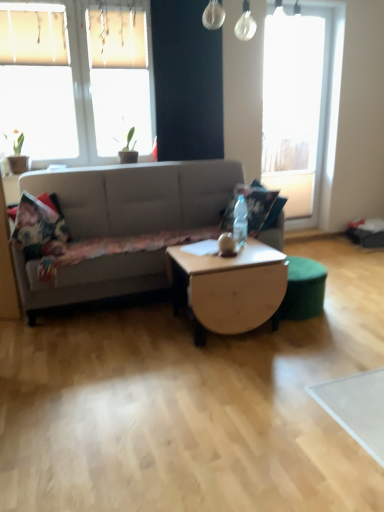
You are a GUI agent. You are given a task and a screenshot of the screen. Output one action in this format:
    pyautogui.click(x=<x>, y=<y>)
    Task: Click on the vacant space positioned to the left of wooden coffee table at center
    Image resolution: width=384 pixels, height=512 pixels.
    Given the screenshot: What is the action you would take?
    pyautogui.click(x=137, y=334)